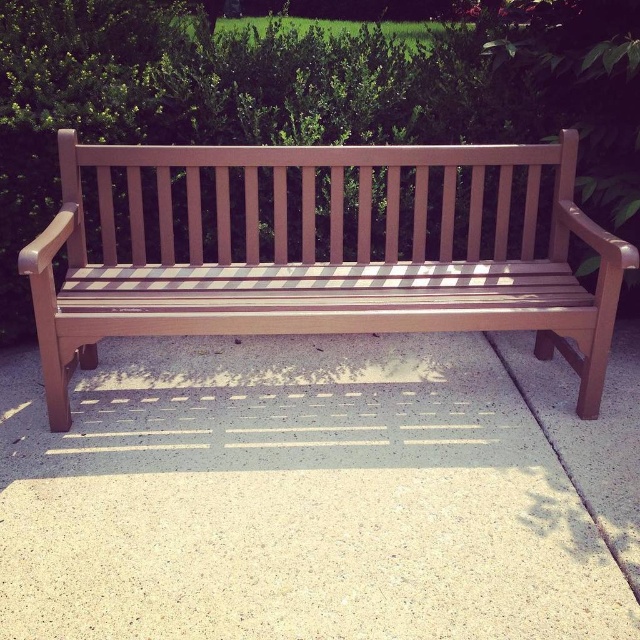
Question: Can you confirm if gray speckled concrete at center is positioned to the right of teak wood bench at center?

Choices:
 (A) yes
 (B) no

Answer: (A)

Question: Which point is farther to the camera?

Choices:
 (A) (76, 330)
 (B) (529, 563)

Answer: (A)

Question: Can you confirm if gray speckled concrete at center is smaller than teak wood bench at center?

Choices:
 (A) yes
 (B) no

Answer: (B)

Question: Which object appears closest to the camera in this image?

Choices:
 (A) gray speckled concrete at center
 (B) teak wood bench at center

Answer: (A)

Question: Can you confirm if gray speckled concrete at center is positioned below teak wood bench at center?

Choices:
 (A) no
 (B) yes

Answer: (B)